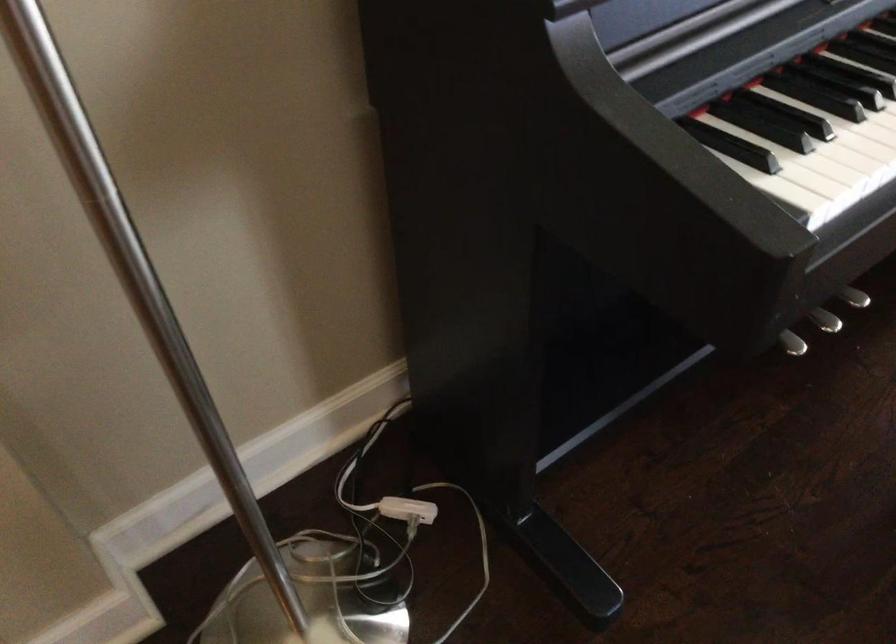
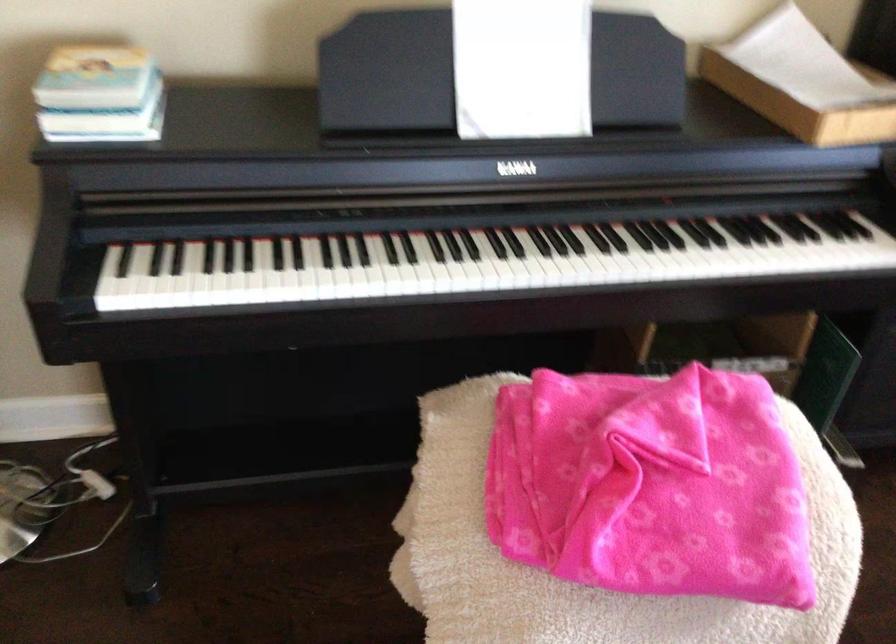
Question: The camera is either moving clockwise (left) or counter-clockwise (right) around the object. The first image is from the beginning of the video and the second image is from the end. Is the camera moving left or right when shooting the video?

Choices:
 (A) Left
 (B) Right

Answer: (B)